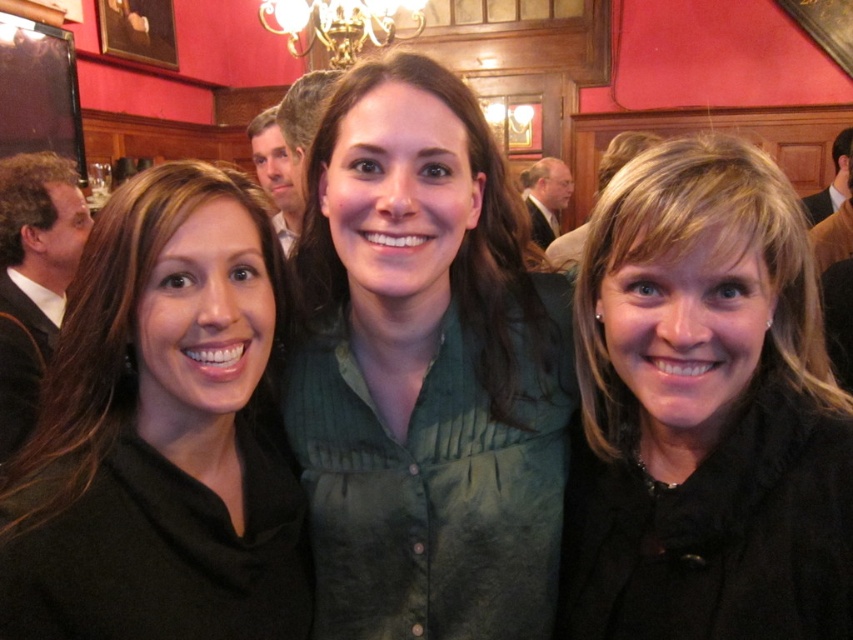
You are standing in the room and want to place a small decorative item between the two points, point 1 at point [550,531] and point 2 at point [380,20]. Which point should you stand closer to when placing the item?

You should stand closer to point 1 at point [550,531] because it is closer to the viewer than point 2 at point [380,20].

You are a photographer trying to adjust the lighting for a group photo. You notice the black matte jacket at right is casting a shadow on the wall. Where should you position the light source to ensure the shadow falls behind the group instead of on the wall? Please provide coordinates relative to the image frame where the light source should be placed.

To ensure the shadow of the black matte jacket at right falls behind the group instead of on the wall, the light source should be positioned to the left of the jacket. Since the jacket is located at coordinates approximately 0.645 on the x and 0.826 on the y, placing the light source to the left side of the image frame would direct the shadow away from the wall and towards the background.